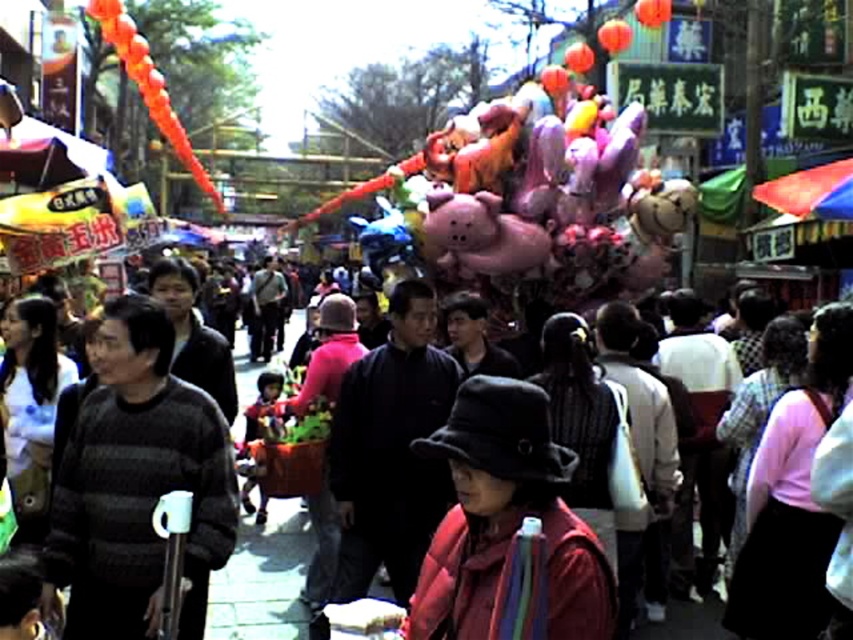
Question: Which point is farther from the camera taking this photo?

Choices:
 (A) (260, 540)
 (B) (119, 516)

Answer: (A)

Question: Among these points, which one is nearest to the camera?

Choices:
 (A) (183, 486)
 (B) (282, 536)

Answer: (A)

Question: Among these objects, which one is farthest from the camera?

Choices:
 (A) striped sweater at center
 (B) dark gray sweater at center

Answer: (B)

Question: Does striped sweater at center appear on the left side of dark gray sweater at center?

Choices:
 (A) yes
 (B) no

Answer: (B)

Question: Is striped sweater at center thinner than dark gray sweater at center?

Choices:
 (A) yes
 (B) no

Answer: (A)

Question: Is striped sweater at center positioned in front of dark gray sweater at center?

Choices:
 (A) no
 (B) yes

Answer: (B)